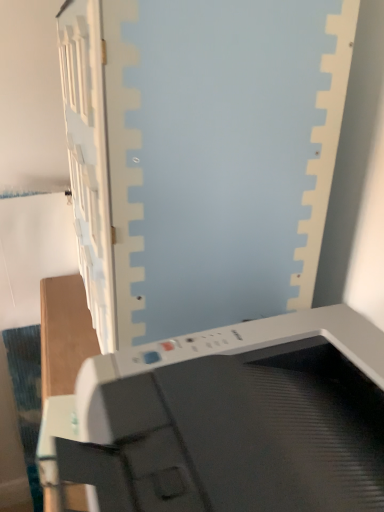
Identify the location of free space above black rubber treadmill at lower center (from a real-world perspective). (244, 379).